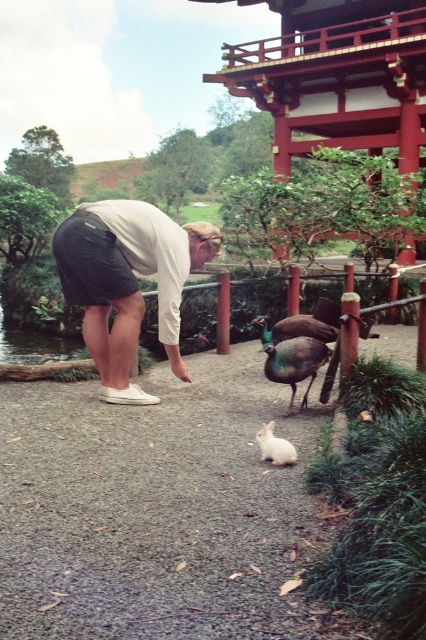
Does white cotton shirt at center have a larger size compared to green iridescent feathers at center?

Yes.

Which is in front, point (74, 212) or point (299, 346)?

Positioned in front is point (299, 346).

Find the location of a particular element. white cotton shirt at center is located at coordinates (127, 282).

Locate an element on the screen. This screenshot has height=640, width=426. white cotton shirt at center is located at coordinates (127, 282).

Between white cotton shirt at center and white fluffy rabbit at lower center, which one has less height?

white fluffy rabbit at lower center

Is point (135, 330) positioned before point (270, 454)?

No, it is behind (270, 454).

Identify the location of white cotton shirt at center. This screenshot has height=640, width=426. (127, 282).

Is green iridescent feathers at center behind white fluffy rabbit at lower center?

That is True.

Which is behind, point (307, 339) or point (264, 456)?

The point (307, 339) is more distant.

Between point (287, 381) and point (261, 456), which one is positioned in front?

Point (261, 456) is more forward.

The width and height of the screenshot is (426, 640). Identify the location of green iridescent feathers at center. (291, 358).